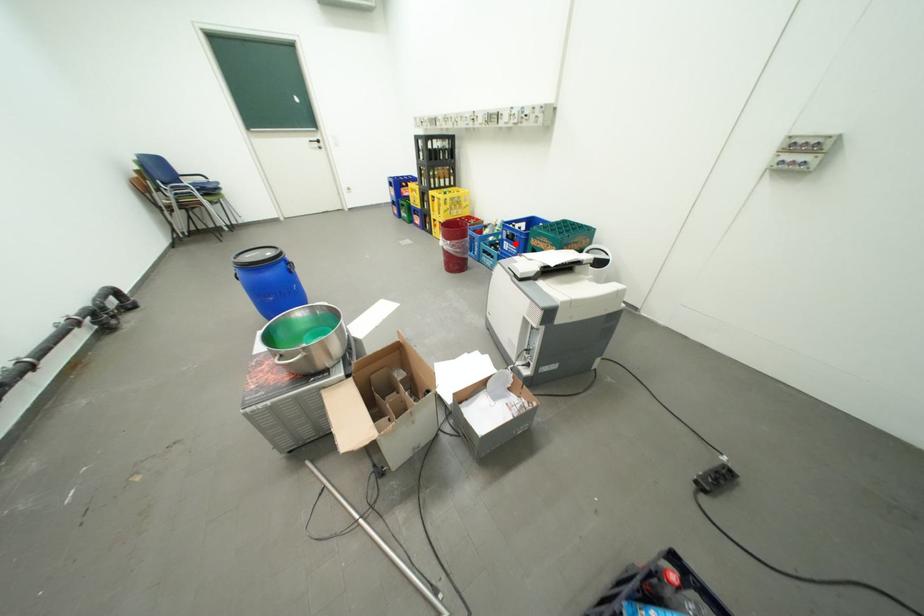
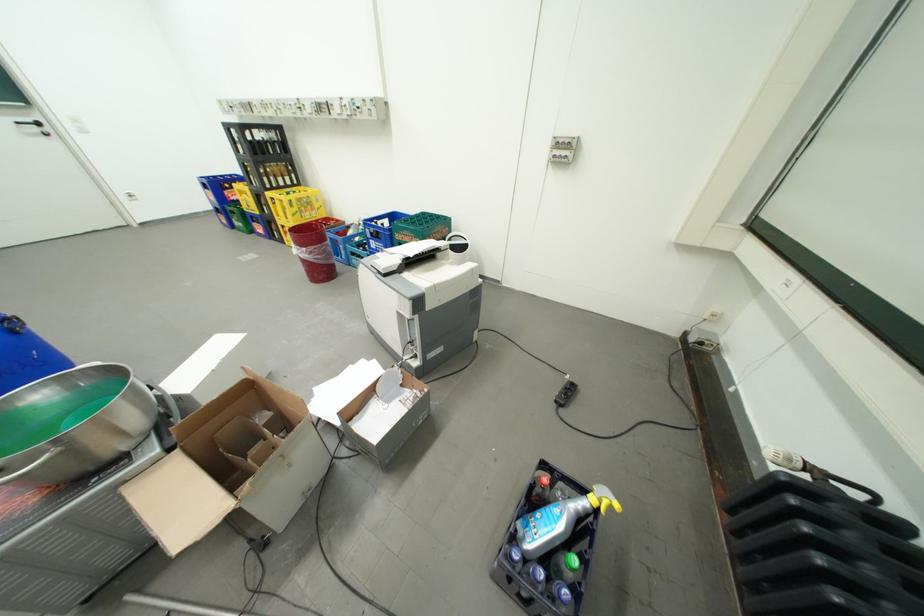
Question: A red point is marked in image1. In image2, is the corresponding 3D point closer to the camera or farther? Reply with the corresponding letter.

Choices:
 (A) The corresponding 3D point is closer.
 (B) The corresponding 3D point is farther.

Answer: (B)